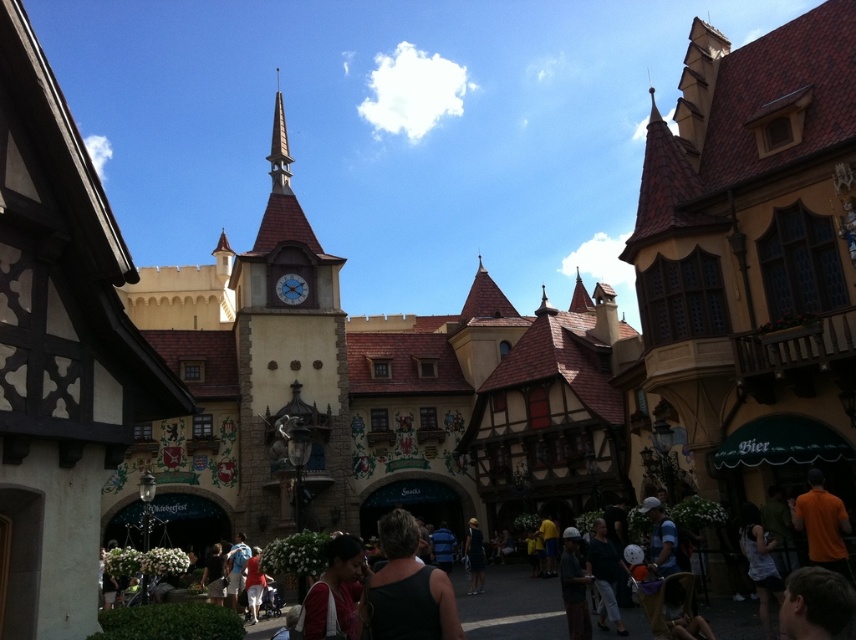
Can you confirm if black fabric at center is positioned below black matte dress at center?

Incorrect, black fabric at center is not positioned below black matte dress at center.

Is black fabric at center to the left of black matte dress at center from the viewer's perspective?

Indeed, black fabric at center is positioned on the left side of black matte dress at center.

This screenshot has width=856, height=640. What do you see at coordinates (408, 588) in the screenshot?
I see `black fabric at center` at bounding box center [408, 588].

Find the location of a particular element. The width and height of the screenshot is (856, 640). black fabric at center is located at coordinates (408, 588).

Which of these two, matte stone clock tower at center or matte pink dress at center, stands shorter?

With less height is matte pink dress at center.

Locate an element on the screen. matte stone clock tower at center is located at coordinates (290, 365).

How far apart are matte pink dress at center and blue glass clock at center?

The distance of matte pink dress at center from blue glass clock at center is 51.25 meters.

Between matte pink dress at center and blue glass clock at center, which one is positioned lower?

Positioned lower is matte pink dress at center.

Is point (343, 586) closer to camera compared to point (299, 282)?

Yes, point (343, 586) is in front of point (299, 282).

Find the location of `matte pink dress at center`. matte pink dress at center is located at coordinates (334, 593).